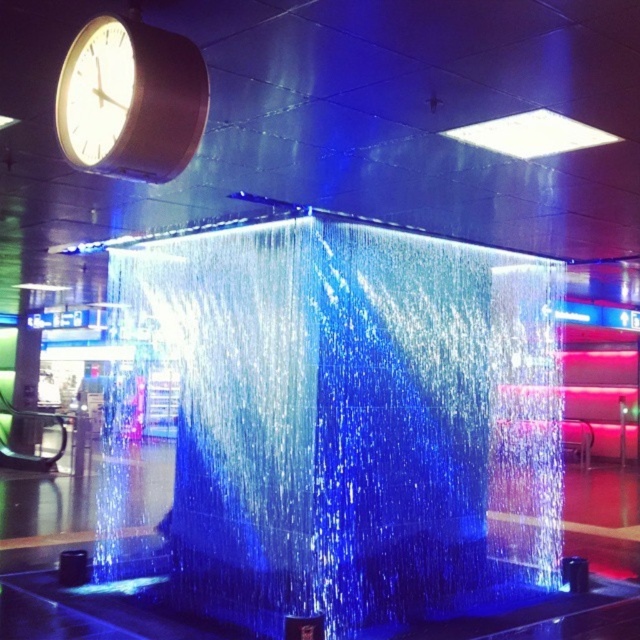
Can you confirm if translucent glass cube at center is positioned above white glossy square at upper center?

No, translucent glass cube at center is not above white glossy square at upper center.

Who is lower down, translucent glass cube at center or white glossy square at upper center?

translucent glass cube at center is lower down.

Is point (340, 582) less distant than point (525, 145)?

No, (340, 582) is further to viewer.

Find the location of a particular element. The height and width of the screenshot is (640, 640). translucent glass cube at center is located at coordinates (349, 419).

I want to click on translucent glass cube at center, so click(x=349, y=419).

Image resolution: width=640 pixels, height=640 pixels. Describe the element at coordinates (349, 419) in the screenshot. I see `translucent glass cube at center` at that location.

What do you see at coordinates (349, 419) in the screenshot?
I see `translucent glass cube at center` at bounding box center [349, 419].

This screenshot has height=640, width=640. In order to click on translucent glass cube at center in this screenshot , I will do `click(349, 419)`.

Between matte black clock at upper left and white glossy square at upper center, which one appears on the left side from the viewer's perspective?

matte black clock at upper left is more to the left.

Between point (97, 109) and point (534, 141), which one is positioned in front?

Point (97, 109)

Locate an element on the screen. matte black clock at upper left is located at coordinates (131, 100).